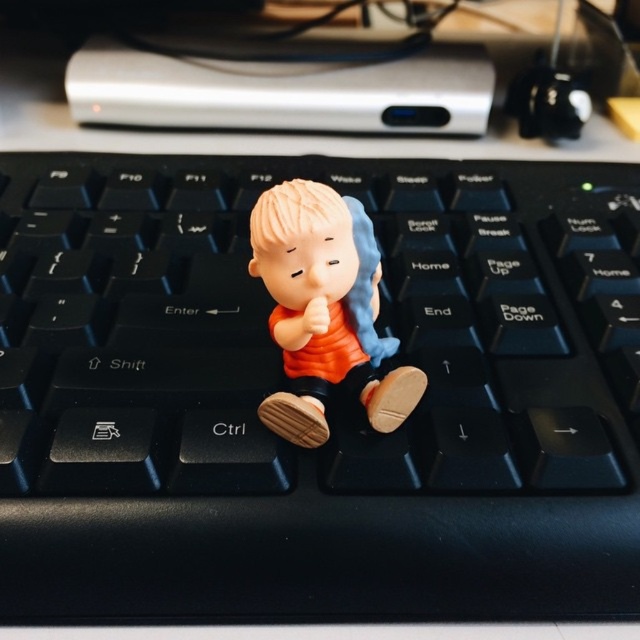
You are a delivery robot trying to place a small package on the keyboard. The package is 30 inches long. You need to know if the package can fit along the longest dimension of the keyboard. The package must be placed starting at point (35, 356). Can you determine if the package will fit?

The distance from point (35, 356) to the camera is 29.80 inches. Since the package is 30 inches long, it is slightly longer than the available space, so the package will not fit.

You are setting up a desk and want to place both the black plastic keyboard at center and the matte orange figurine at center. Considering their heights, which object would you need to adjust to ensure they are at the same level?

The black plastic keyboard at center is taller than the matte orange figurine at center. To make them level, you should lower the black plastic keyboard at center or raise the matte orange figurine at center.

You are a graphic designer working on a project and need to place a new icon on your computer keyboard. The keyboard has a glossy surface and is placed at the center of your workspace. You have a point marked at coordinates (278, 349). Where exactly should you place the new icon to match the existing design elements on the keyboard?

The point (278, 349) is on the black plastic keyboard at center, so you should place the new icon on the black plastic keyboard at center to align with the existing design elements.